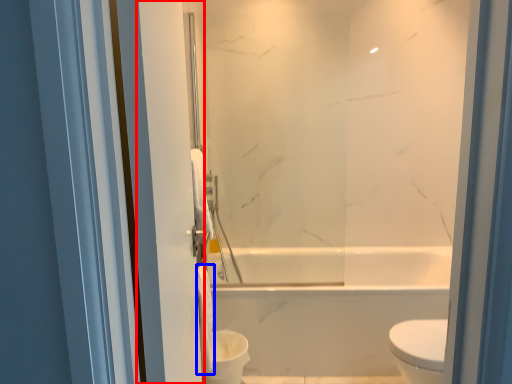
Question: Among these objects, which one is nearest to the camera, screen door (highlighted by a red box) or toilet paper (highlighted by a blue box)?

Choices:
 (A) screen door
 (B) toilet paper

Answer: (A)